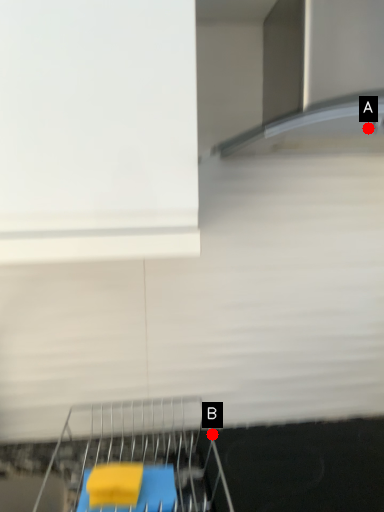
Question: Two points are circled on the image, labeled by A and B beside each circle. Which point is closer to the camera?

Choices:
 (A) A is closer
 (B) B is closer

Answer: (A)